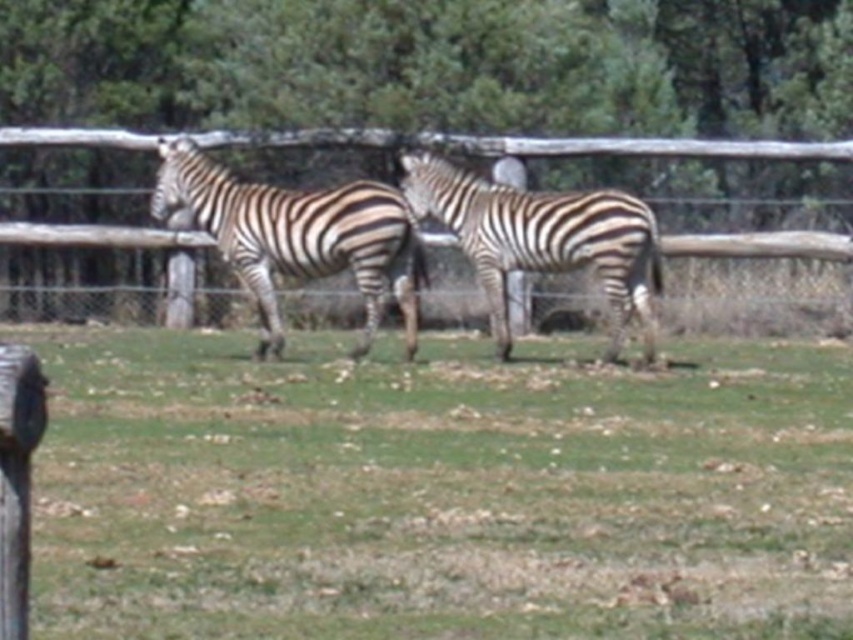
You are a zookeeper trying to count the zebras in the enclosure. You see the black and white striped zebra at left and the wooden fence at center. Which object is closer to you?

The black and white striped zebra at left is closer to you because it is positioned over the wooden fence at center, indicating it is in front of the fence.

You are a zookeeper planning to mow the green grass at center and the black and white striped zebra at left. Which area requires a wider mower path to accommodate its size?

The green grass at center requires a wider mower path since its width is larger than the black and white striped zebra at left.

You are a wildlife photographer aiming to capture a photo of the black and white striped zebra at left and the wooden fence at center. If you want to ensure both are fully visible in your shot, which object should you focus on first?

The black and white striped zebra at left is taller than the wooden fence at center, so you should focus on the zebra first to ensure it is fully visible in the frame.